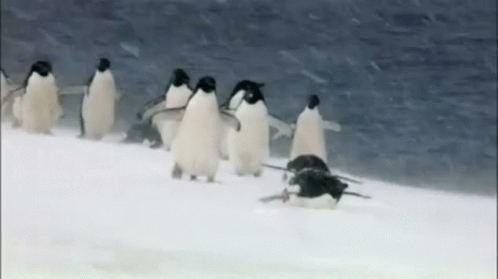
Identify the location of white fur. This screenshot has height=279, width=498. (35, 105), (115, 104), (208, 142), (293, 147), (254, 150), (178, 134).